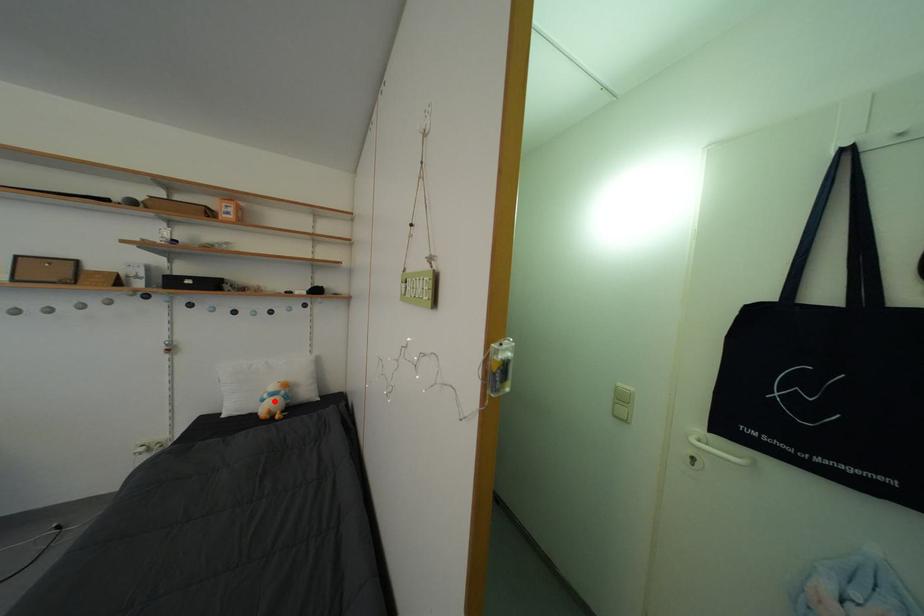
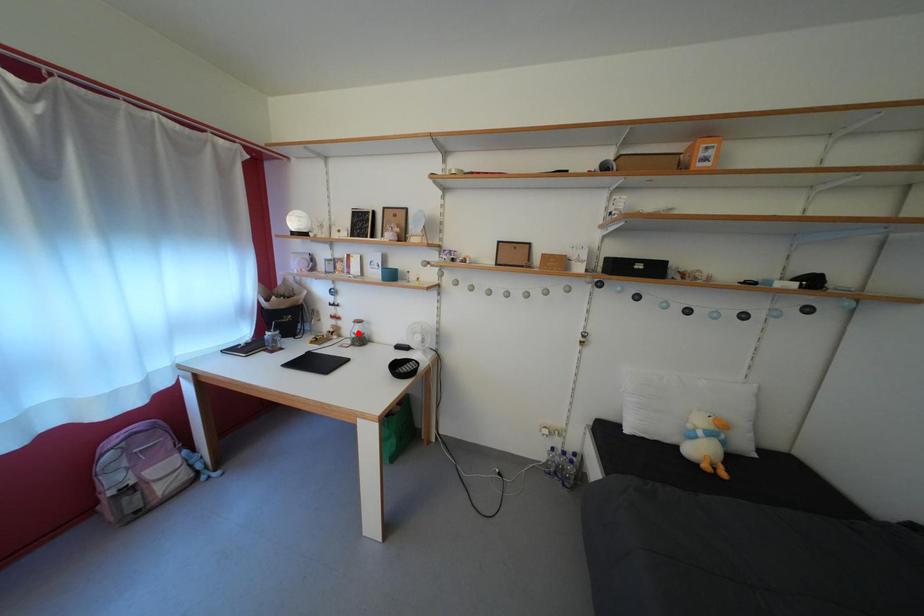
I am providing you with two images of the same scene from different viewpoints. A red point is marked on the first image and another point is marked on the second image. Is the red point in image1 aligned with the point shown in image2?

No